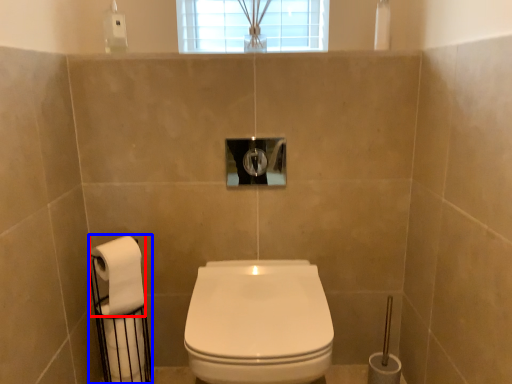
Question: Among these objects, which one is farthest to the camera, toilet paper (highlighted by a red box) or toilet paper (highlighted by a blue box)?

Choices:
 (A) toilet paper
 (B) toilet paper

Answer: (B)